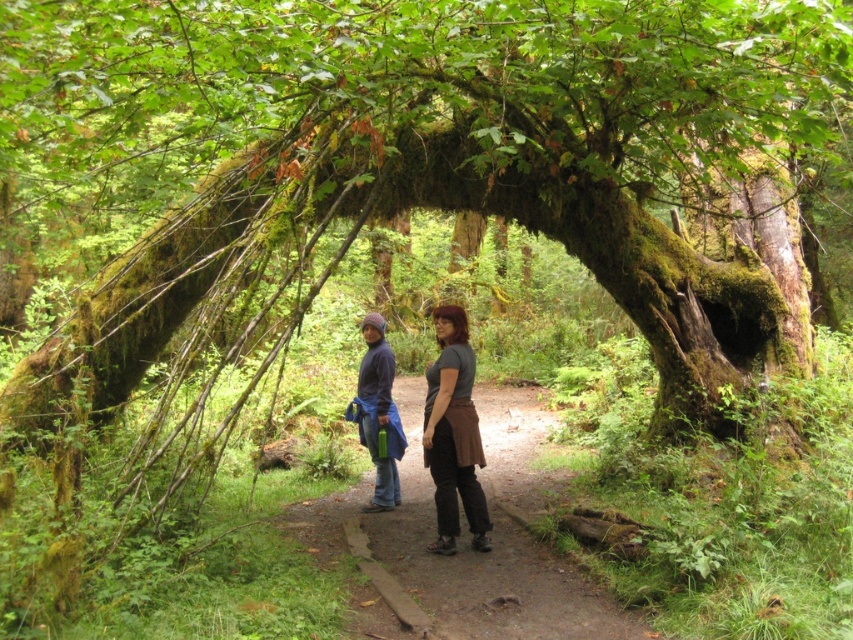
Is dirt path at center further to the viewer compared to brown leather skirt at center?

No, it is in front of brown leather skirt at center.

Which of these two, dirt path at center or brown leather skirt at center, stands taller?

brown leather skirt at center is taller.

Who is more distant from viewer, (x=527, y=604) or (x=451, y=554)?

Positioned behind is point (x=451, y=554).

Find the location of `dirt path at center`. dirt path at center is located at coordinates (468, 541).

Does dark gray fabric at center have a lesser width compared to brown leather skirt at center?

No.

Is dark gray fabric at center closer to camera compared to brown leather skirt at center?

Yes, it is in front of brown leather skirt at center.

Which is behind, point (424, 440) or point (451, 472)?

Positioned behind is point (424, 440).

This screenshot has width=853, height=640. I want to click on dark gray fabric at center, so click(x=453, y=435).

In the scene shown: Is the position of dirt path at center less distant than that of dark gray fabric at center?

Yes, dirt path at center is closer to the viewer.

Is dirt path at center below dark gray fabric at center?

Yes.

This screenshot has width=853, height=640. Describe the element at coordinates (468, 541) in the screenshot. I see `dirt path at center` at that location.

Identify the location of dirt path at center. (468, 541).